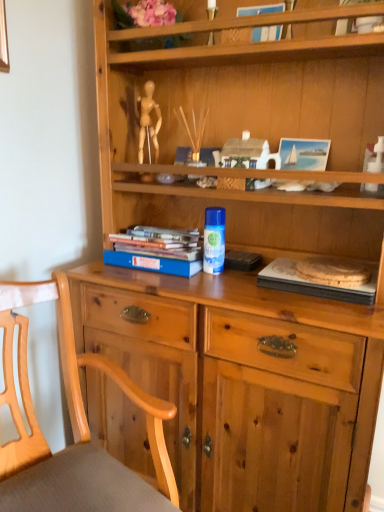
Question: From a real-world perspective, is hardcover books at left, acting as the 2th paperback book starting from the right, over white plastic toy at upper right?

Choices:
 (A) no
 (B) yes

Answer: (A)

Question: Can you confirm if hardcover books at left, acting as the 2th paperback book starting from the right, is smaller than white plastic toy at upper right?

Choices:
 (A) no
 (B) yes

Answer: (A)

Question: Is hardcover books at left, which ranks as the 1th paperback book in left-to-right order, not near white plastic toy at upper right?

Choices:
 (A) yes
 (B) no

Answer: (B)

Question: Considering the relative sizes of hardcover books at left, acting as the 2th paperback book starting from the right, and white plastic toy at upper right in the image provided, is hardcover books at left, acting as the 2th paperback book starting from the right, shorter than white plastic toy at upper right?

Choices:
 (A) yes
 (B) no

Answer: (A)

Question: Considering the relative positions of hardcover books at left, acting as the 2th paperback book starting from the right, and white plastic toy at upper right in the image provided, is hardcover books at left, acting as the 2th paperback book starting from the right, to the left of white plastic toy at upper right from the viewer's perspective?

Choices:
 (A) no
 (B) yes

Answer: (B)

Question: In the image, is white plastic toy at upper right positioned in front of or behind hardcover books at left, which ranks as the 1th paperback book in left-to-right order?

Choices:
 (A) behind
 (B) front

Answer: (B)

Question: From their relative heights in the image, would you say white plastic toy at upper right is taller or shorter than hardcover books at left, which ranks as the 1th paperback book in left-to-right order?

Choices:
 (A) tall
 (B) short

Answer: (A)

Question: Is point (370, 169) positioned closer to the camera than point (135, 256)?

Choices:
 (A) closer
 (B) farther

Answer: (A)

Question: In terms of size, does white plastic toy at upper right appear bigger or smaller than hardcover books at left, acting as the 2th paperback book starting from the right?

Choices:
 (A) small
 (B) big

Answer: (A)

Question: Is wooden chair at lower left in front of or behind blue hardcover book at upper center in the image?

Choices:
 (A) front
 (B) behind

Answer: (A)

Question: In terms of height, does wooden chair at lower left look taller or shorter compared to blue hardcover book at upper center?

Choices:
 (A) tall
 (B) short

Answer: (A)

Question: Is point (74, 455) closer or farther from the camera than point (258, 28)?

Choices:
 (A) closer
 (B) farther

Answer: (A)

Question: From the image's perspective, is wooden chair at lower left located above or below blue hardcover book at upper center?

Choices:
 (A) below
 (B) above

Answer: (A)

Question: Is wooden chair at lower left bigger or smaller than hardcover books at left, acting as the 2th paperback book starting from the right?

Choices:
 (A) small
 (B) big

Answer: (B)

Question: Is point (135, 480) closer or farther from the camera than point (178, 261)?

Choices:
 (A) closer
 (B) farther

Answer: (A)